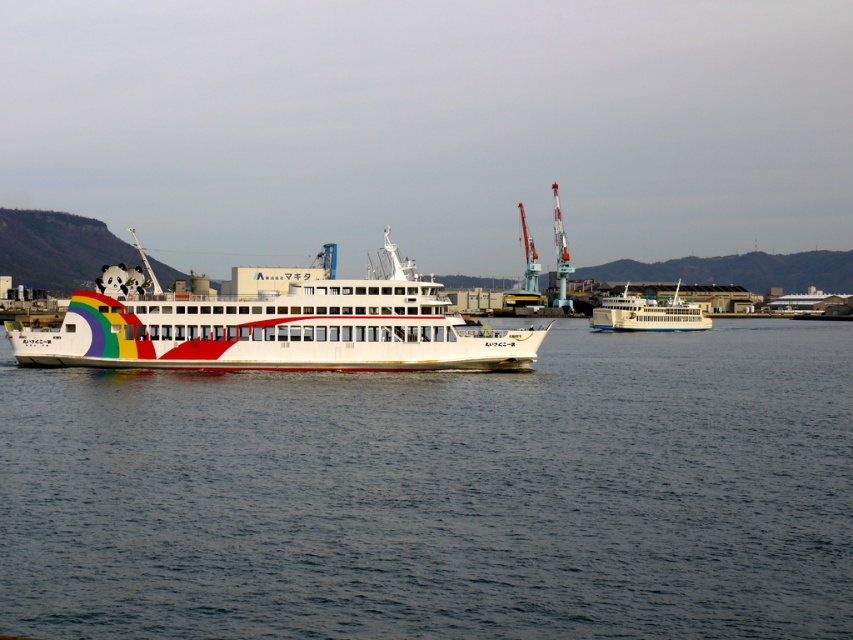
Question: Which of the following is the closest to the observer?

Choices:
 (A) (618, 445)
 (B) (614, 314)
 (C) (380, 337)

Answer: (A)

Question: Can you confirm if clear blue water at center is positioned to the right of rainbow painted ship at center?

Choices:
 (A) no
 (B) yes

Answer: (B)

Question: Which object is farther from the camera taking this photo?

Choices:
 (A) rainbow painted ship at center
 (B) clear blue water at center

Answer: (A)

Question: Is clear blue water at center behind rainbow painted ship at center?

Choices:
 (A) no
 (B) yes

Answer: (A)

Question: Is rainbow painted ship at center above white glossy ferry at center?

Choices:
 (A) yes
 (B) no

Answer: (A)

Question: Which point is farther to the camera?

Choices:
 (A) [x=621, y=307]
 (B) [x=45, y=451]
 (C) [x=126, y=330]

Answer: (A)